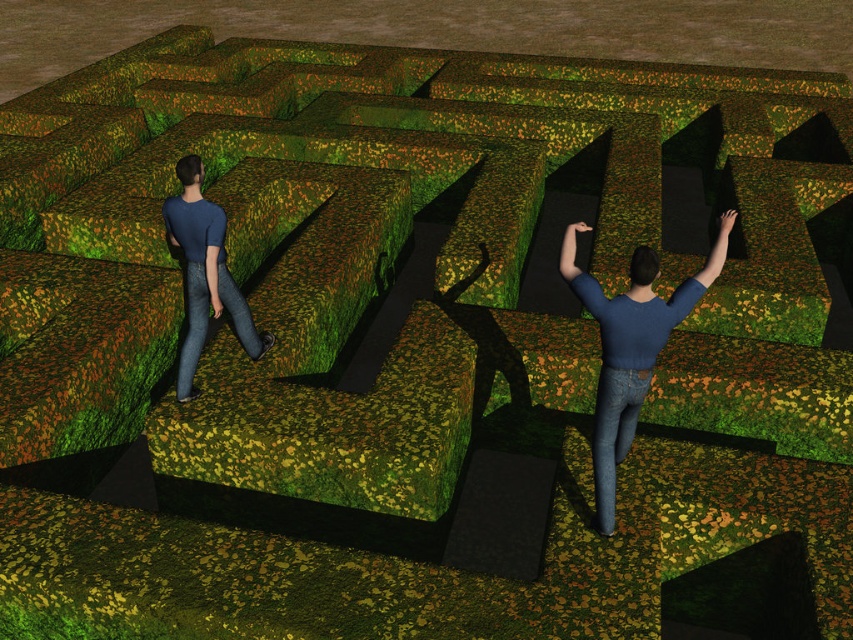
You are a fashion designer observing the two individuals in the maze. You need to determine which clothing item, the denim jeans at lower left or the blue matte shirt at left, requires more fabric based on their size. Which one would you choose?

The denim jeans at lower left is bigger than the blue matte shirt at left, so the denim jeans at lower left would require more fabric.